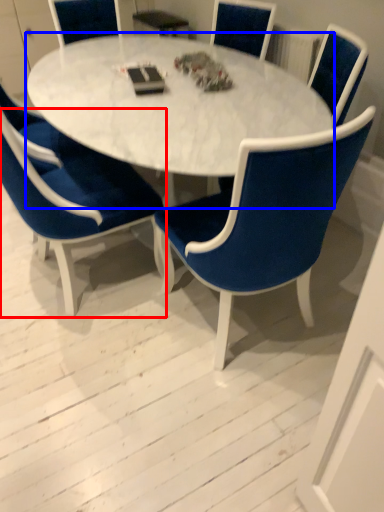
Question: Which object is closer to the camera taking this photo, chair (highlighted by a red box) or coffee table (highlighted by a blue box)?

Choices:
 (A) chair
 (B) coffee table

Answer: (A)